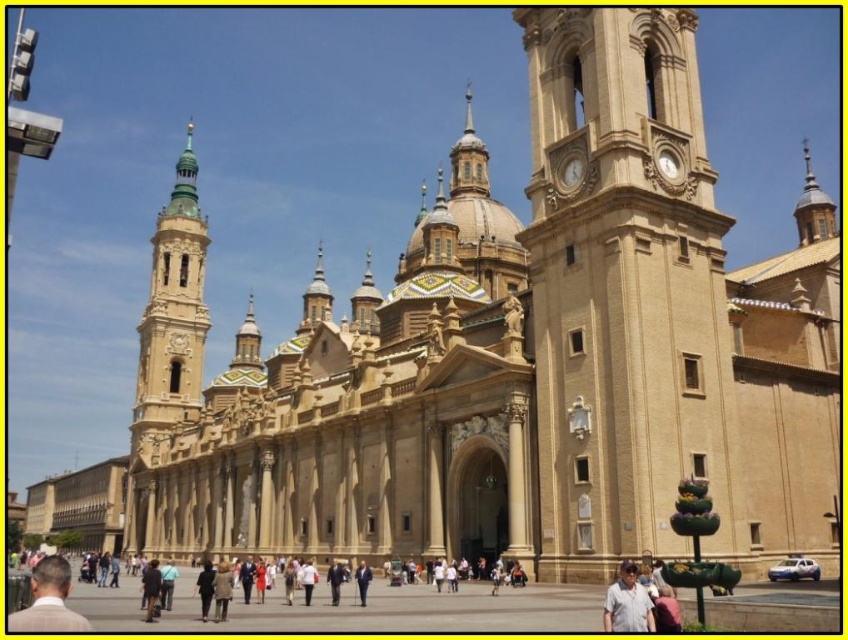
You are standing in front of the cathedral and want to take a photo that includes both the beige brick clock tower at center and the green glazed tile tower at upper left. Which tower should you position closer to the edge of your camera frame to ensure both are fully visible?

You should position the beige brick clock tower at center closer to the edge of your camera frame because it is smaller than the green glazed tile tower at upper left, allowing more space for the larger tower while keeping both in view.

You are standing in front of the cathedral and want to take a photo of both the beige brick clock tower at center and the green glazed tile tower at upper left. Which tower should you focus on first to ensure both are in the frame?

You should focus on the beige brick clock tower at center first because it is closer to the viewer than the green glazed tile tower at upper left, so adjusting the camera to include the closer tower will help capture the farther one as well.